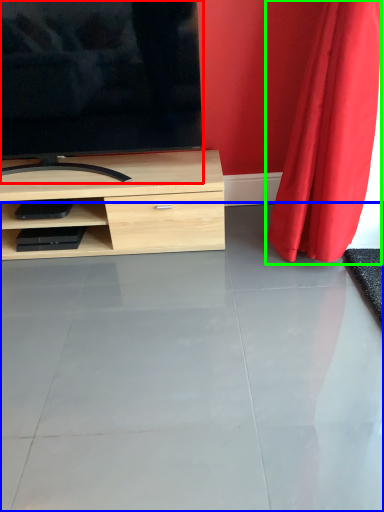
Question: Which object is positioned farthest from television (highlighted by a red box)? Select from concrete (highlighted by a blue box) and curtain (highlighted by a green box).

Choices:
 (A) concrete
 (B) curtain

Answer: (A)